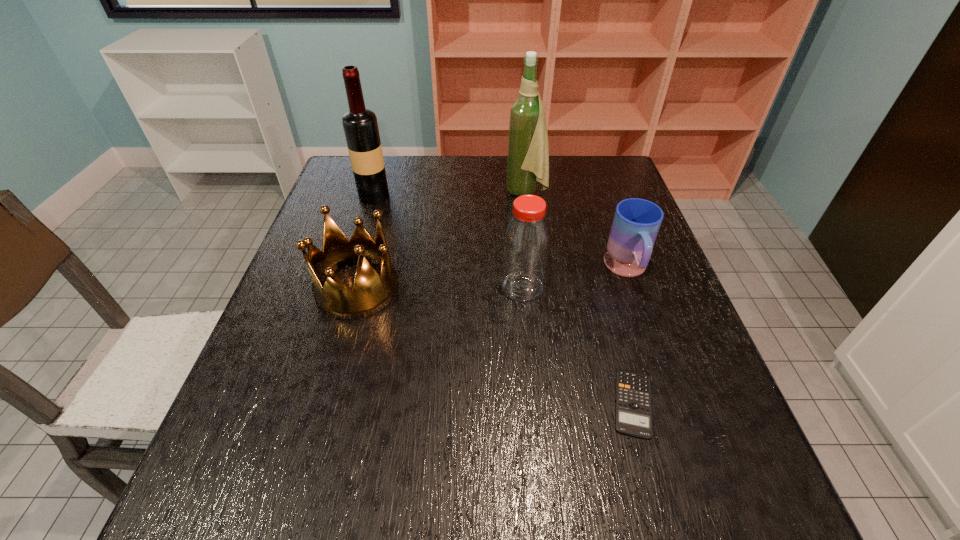
Where is `vacant area between the mug and the left wine bottle`? This screenshot has width=960, height=540. vacant area between the mug and the left wine bottle is located at coordinates (500, 233).

At what (x,y) coordinates should I click in order to perform the action: click on vacant space that's between the crown and the second shortest object. Please return your answer as a coordinate pair (x, y). The width and height of the screenshot is (960, 540). Looking at the image, I should click on (492, 279).

In order to click on free space between the right wine bottle and the second shortest object in this screenshot , I will do click(x=577, y=231).

Where is `free spot between the crown and the shortest object`? The image size is (960, 540). free spot between the crown and the shortest object is located at coordinates (495, 346).

Find the location of a particular element. vacant space that's between the calculator and the crown is located at coordinates (495, 346).

This screenshot has height=540, width=960. Find the location of `the second closest object to the fifth tallest object`. the second closest object to the fifth tallest object is located at coordinates (633, 415).

Point out which object is positioned as the second nearest to the right wine bottle. Please provide its 2D coordinates. Your answer should be formatted as a tuple, i.e. [(x, y)], where the tuple contains the x and y coordinates of a point satisfying the conditions above.

[(526, 242)]

I want to click on vacant space that satisfies the following two spatial constraints: 1. on the front-facing side of the right wine bottle; 2. on the front side of the left wine bottle, so click(527, 196).

Where is `free space that satisfies the following two spatial constraints: 1. on the front-facing side of the right wine bottle; 2. on the front side of the left wine bottle`? free space that satisfies the following two spatial constraints: 1. on the front-facing side of the right wine bottle; 2. on the front side of the left wine bottle is located at coordinates (527, 196).